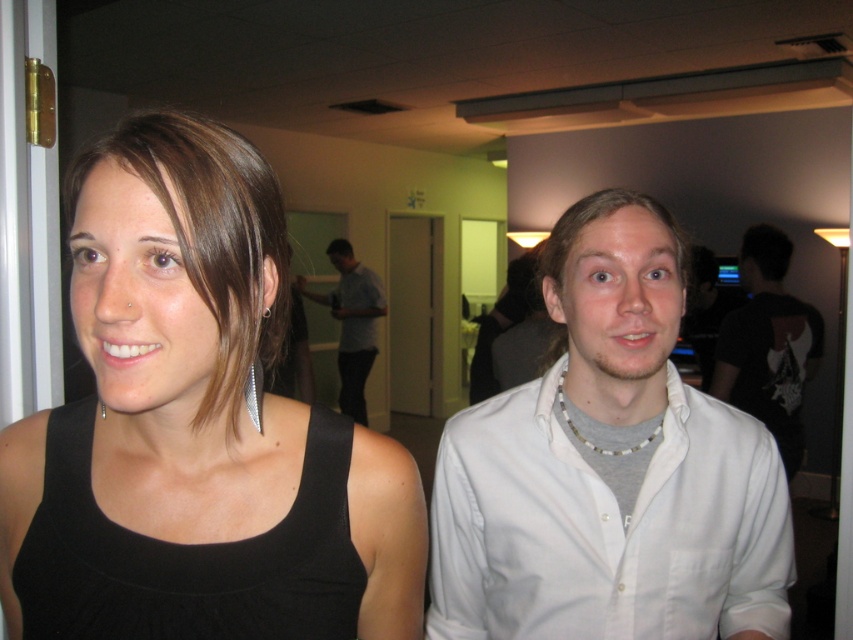
You are organizing a photo shoot and need to ensure that the white cotton shirt at right and the silver metallic earring at left ear are visible in the frame. Given their sizes, which object might require more space in the camera frame to capture it properly?

The white cotton shirt at right requires more space in the camera frame because its width is larger than the silver metallic earring at left ear.

You are a photographer trying to capture a candid shot of the black fabric tank top at left and the man in white button up shirt at right. The camera can only focus on objects within a 15 inch range. Can you capture both subjects in focus?

The black fabric tank top at left and the man in white button up shirt at right are 18.05 inches apart, which exceeds the camera focus range of 15 inches. Therefore, both subjects cannot be captured in focus simultaneously.